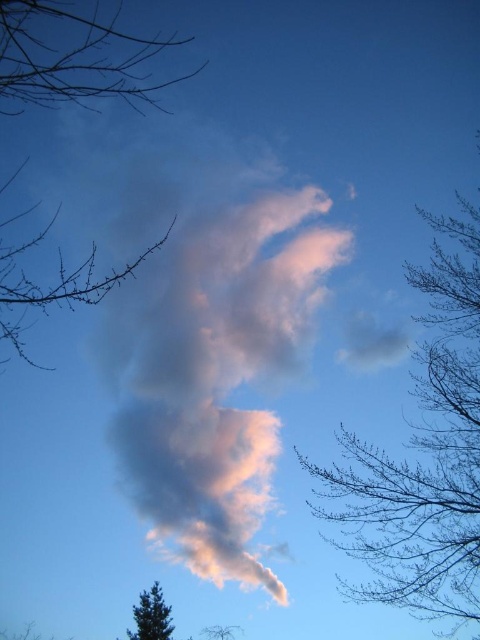
Question: Is pearly white cloud at center wider than green matte tree at lower left?

Choices:
 (A) no
 (B) yes

Answer: (B)

Question: Which point is farther to the camera?

Choices:
 (A) (72, 67)
 (B) (156, 598)
 (C) (458, 234)
 (D) (2, 80)

Answer: (B)

Question: Which point is closer to the camera?

Choices:
 (A) (203, 627)
 (B) (34, 28)
 (C) (83, 289)
 (D) (396, 586)

Answer: (C)

Question: Considering the relative positions of pearly white cloud at center and brown bark tree at upper left in the image provided, where is pearly white cloud at center located with respect to brown bark tree at upper left?

Choices:
 (A) above
 (B) below

Answer: (B)

Question: Can you confirm if pearly white cloud at center is positioned above brown textured tree at lower left?

Choices:
 (A) yes
 (B) no

Answer: (A)

Question: Which of the following is the closest to the observer?

Choices:
 (A) (132, 56)
 (B) (156, 584)
 (C) (452, 513)
 (D) (162, 442)

Answer: (A)